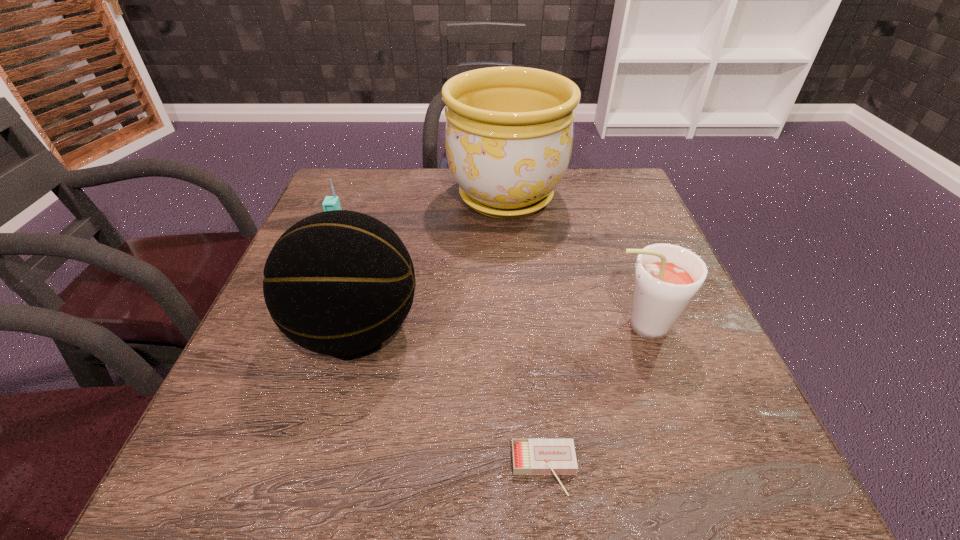
What are the coordinates of `free spot located 0.310m on the drink side of the third tallest object` in the screenshot? It's located at (441, 327).

Image resolution: width=960 pixels, height=540 pixels. Identify the location of free space located on the drink side of the third tallest object. (523, 327).

The image size is (960, 540). In order to click on vacant space located 0.390m on the keypad of the second shortest object in this screenshot , I will do `click(282, 379)`.

Where is `object that is at the far edge`? This screenshot has height=540, width=960. object that is at the far edge is located at coordinates (509, 130).

Where is `object located in the near edge section of the desktop`? The height and width of the screenshot is (540, 960). object located in the near edge section of the desktop is located at coordinates (555, 457).

Find the location of a particular element. basketball located at the left edge is located at coordinates (338, 283).

Where is `cellular telephone located at the left edge`? The image size is (960, 540). cellular telephone located at the left edge is located at coordinates (330, 203).

I want to click on object that is at the right edge, so click(x=667, y=277).

Where is `blank space at the far edge of the desktop`? This screenshot has height=540, width=960. blank space at the far edge of the desktop is located at coordinates (419, 173).

In order to click on vacant position at the near edge of the desktop in this screenshot , I will do `click(589, 449)`.